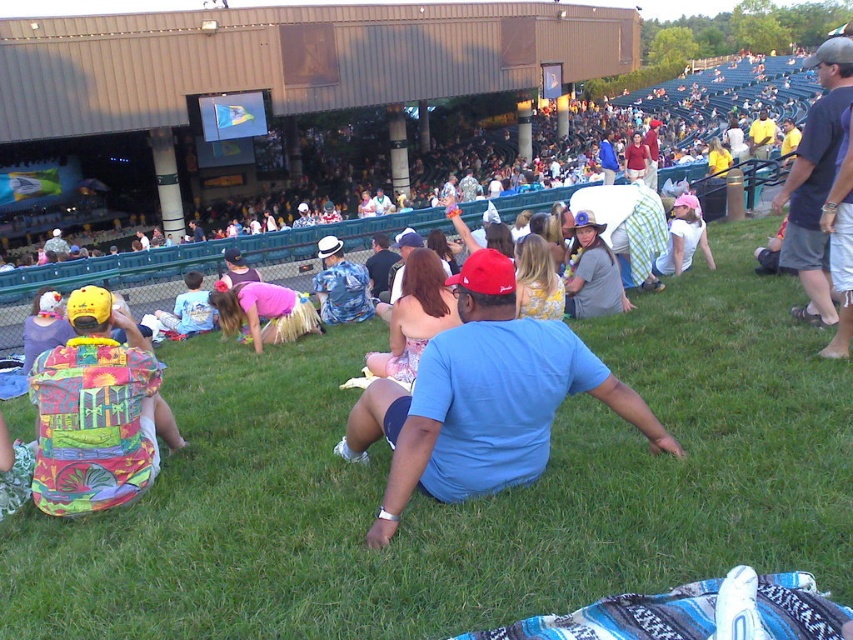
Question: Which is nearer to the printed fabric backpack at lower left?

Choices:
 (A) printed fabric shirt at center
 (B) green grass at center

Answer: (B)

Question: Is blue cotton shirt at center smaller than pink fabric skirt at center?

Choices:
 (A) no
 (B) yes

Answer: (A)

Question: Is matte blue shirt at center below matte gray shirt at center?

Choices:
 (A) yes
 (B) no

Answer: (B)

Question: Which point is closer to the camera?

Choices:
 (A) (325, 262)
 (B) (686, 262)

Answer: (B)

Question: Which is nearer to the white cotton shirt at center?

Choices:
 (A) pink fabric skirt at center
 (B) blue cotton shirt at center
 (C) green grass at center

Answer: (A)

Question: Can you confirm if printed fabric backpack at lower left is wider than matte gray shirt at center?

Choices:
 (A) no
 (B) yes

Answer: (B)